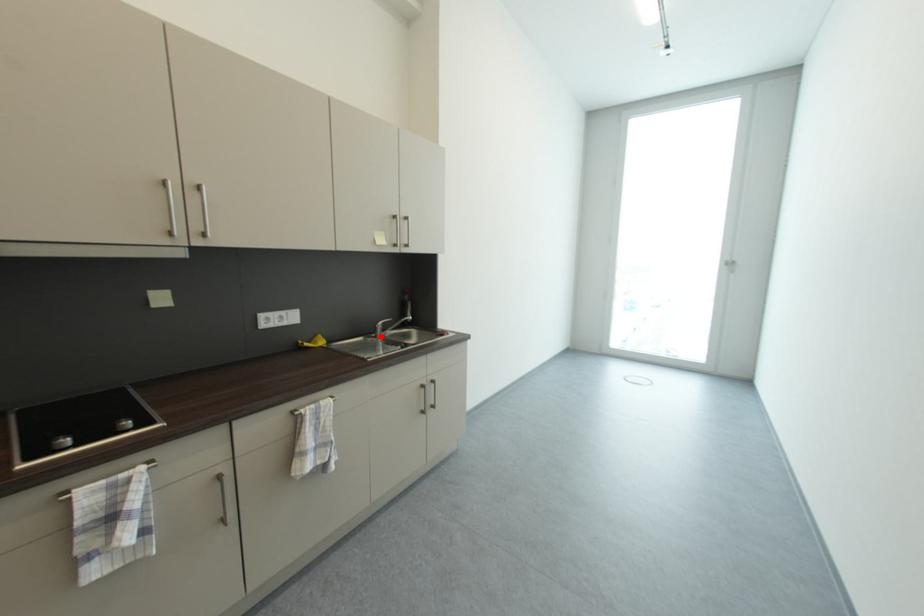
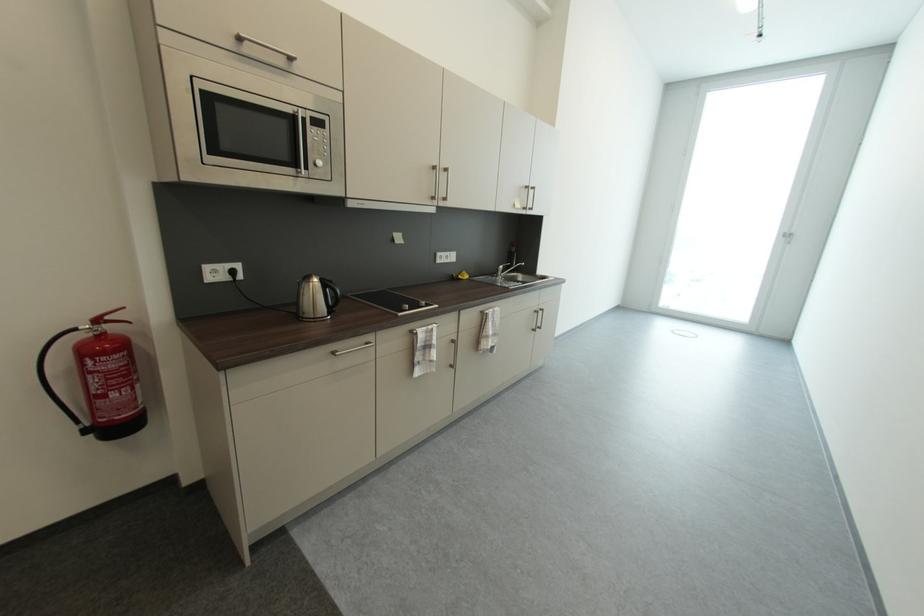
Locate, in the second image, the point that corresponds to the highlighted location in the first image.

(502, 277)